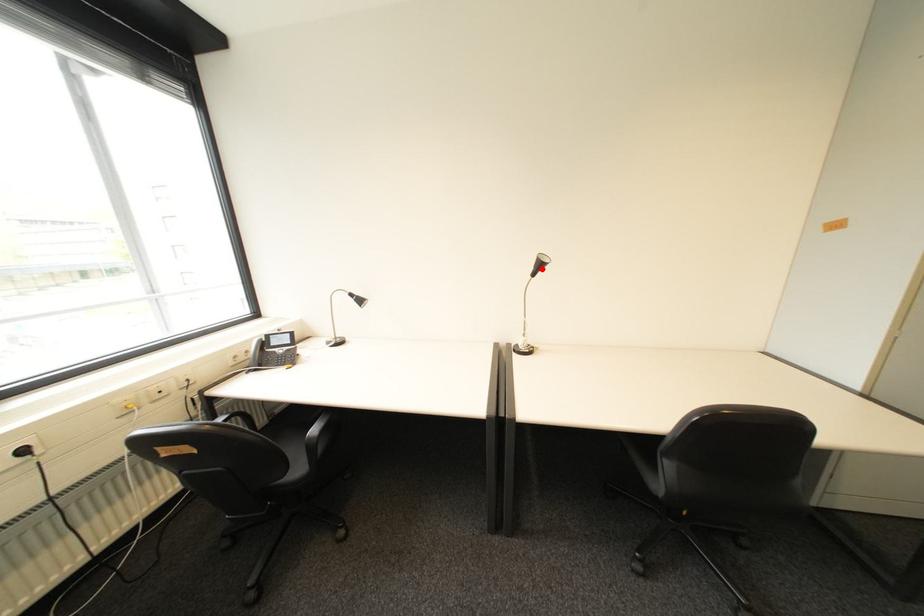
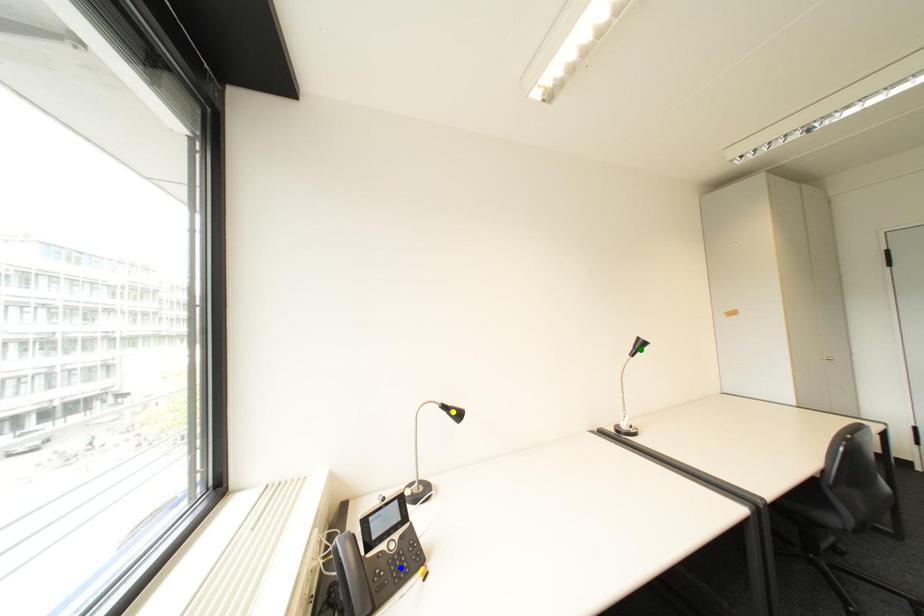
Question: I am providing you with two images of the same scene from different viewpoints. A red point is marked on the first image. You are given multiple points on the second image. Can you choose the point in image 2 that corresponds to the point in image 1?

Choices:
 (A) yellow point
 (B) green point
 (C) blue point

Answer: (B)